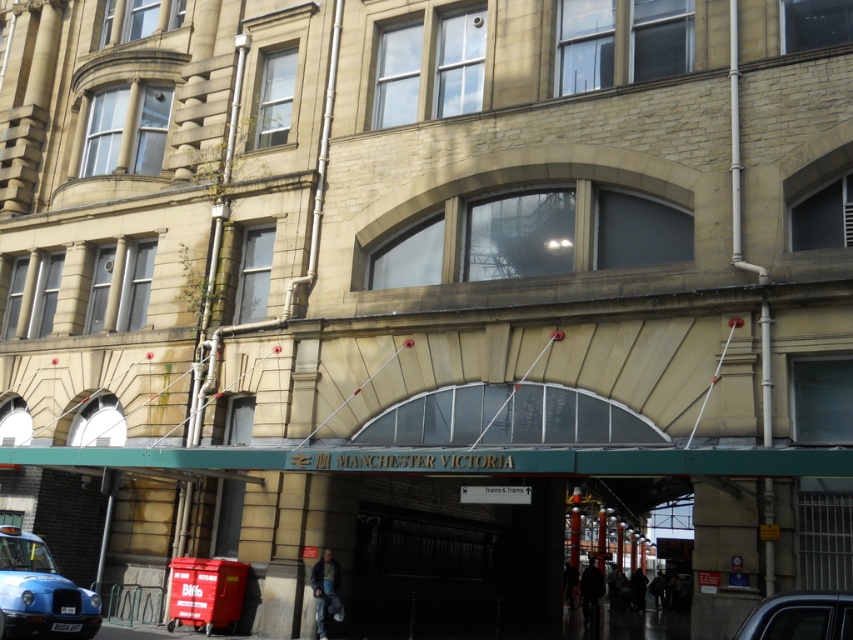
Find the location of a particular element. The image size is (853, 640). matte blue taxi at lower left is located at coordinates (39, 593).

Who is positioned more to the left, matte blue taxi at lower left or metallic blue car at lower right?

matte blue taxi at lower left is more to the left.

Which is behind, point (15, 618) or point (824, 611)?

The point (15, 618) is behind.

The height and width of the screenshot is (640, 853). Identify the location of matte blue taxi at lower left. (39, 593).